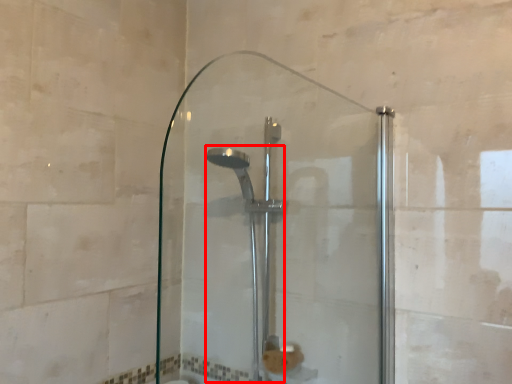
Question: In this image, where is shower (annotated by the red box) located relative to screen door?

Choices:
 (A) right
 (B) left

Answer: (B)